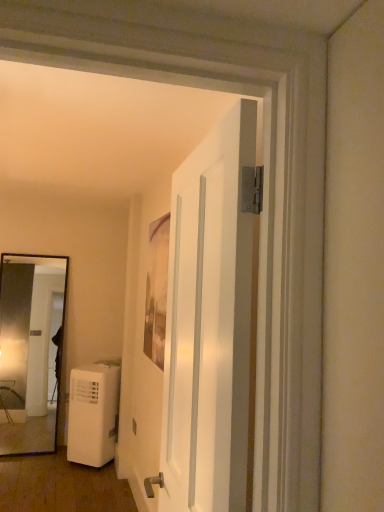
Question: Is the position of white matte door at center less distant than that of white plastic air conditioner at lower left?

Choices:
 (A) no
 (B) yes

Answer: (B)

Question: Is white matte door at center further to camera compared to white plastic air conditioner at lower left?

Choices:
 (A) yes
 (B) no

Answer: (B)

Question: Is white matte door at center smaller than white plastic air conditioner at lower left?

Choices:
 (A) no
 (B) yes

Answer: (B)

Question: From the image's perspective, is white matte door at center located above white plastic air conditioner at lower left?

Choices:
 (A) yes
 (B) no

Answer: (A)

Question: Is white matte door at center facing away from white plastic air conditioner at lower left?

Choices:
 (A) no
 (B) yes

Answer: (A)

Question: Does white matte door at center appear on the right side of white plastic air conditioner at lower left?

Choices:
 (A) yes
 (B) no

Answer: (A)

Question: Does white plastic air conditioner at lower left have a lesser width compared to white matte air purifier at lower left?

Choices:
 (A) no
 (B) yes

Answer: (B)

Question: Can you confirm if white plastic air conditioner at lower left is wider than white matte air purifier at lower left?

Choices:
 (A) no
 (B) yes

Answer: (A)

Question: Considering the relative positions of white plastic air conditioner at lower left and white matte air purifier at lower left in the image provided, is white plastic air conditioner at lower left to the right of white matte air purifier at lower left from the viewer's perspective?

Choices:
 (A) yes
 (B) no

Answer: (A)

Question: Would you consider white plastic air conditioner at lower left to be distant from white matte air purifier at lower left?

Choices:
 (A) no
 (B) yes

Answer: (A)

Question: Is white plastic air conditioner at lower left at the left side of white matte air purifier at lower left?

Choices:
 (A) no
 (B) yes

Answer: (A)

Question: From a real-world perspective, is white plastic air conditioner at lower left positioned over white matte air purifier at lower left based on gravity?

Choices:
 (A) yes
 (B) no

Answer: (A)

Question: Can you see white plastic air conditioner at lower left touching white matte door at center?

Choices:
 (A) no
 (B) yes

Answer: (A)